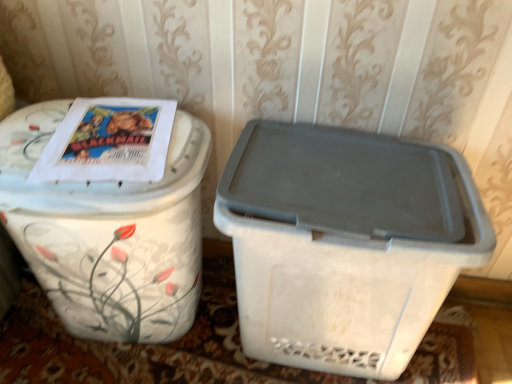
Find the location of a particular element. The width and height of the screenshot is (512, 384). white glossy trash can at upper left, arranged as the 1th waste container when viewed from the left is located at coordinates (109, 233).

Describe the element at coordinates (109, 233) in the screenshot. I see `white glossy trash can at upper left, arranged as the 1th waste container when viewed from the left` at that location.

Identify the location of white plastic container at right, the second waste container from the left. (345, 243).

What do you see at coordinates (345, 243) in the screenshot?
I see `white plastic container at right, the second waste container from the left` at bounding box center [345, 243].

The height and width of the screenshot is (384, 512). I want to click on white glossy trash can at upper left, acting as the 2th waste container starting from the right, so click(x=109, y=233).

Between white plastic container at right, the second waste container from the left, and white glossy trash can at upper left, arranged as the 1th waste container when viewed from the left, which one appears on the left side from the viewer's perspective?

From the viewer's perspective, white glossy trash can at upper left, arranged as the 1th waste container when viewed from the left, appears more on the left side.

Based on the photo, considering the positions of objects white plastic container at right, which ranks as the first waste container in right-to-left order, and white glossy trash can at upper left, acting as the 2th waste container starting from the right, in the image provided, who is in front, white plastic container at right, which ranks as the first waste container in right-to-left order, or white glossy trash can at upper left, acting as the 2th waste container starting from the right,?

white glossy trash can at upper left, acting as the 2th waste container starting from the right, is more forward.

Is point (393, 278) closer or farther from the camera than point (26, 252)?

Clearly, point (393, 278) is closer to the camera than point (26, 252).

From the image's perspective, which one is positioned higher, white plastic container at right, which ranks as the first waste container in right-to-left order, or white glossy trash can at upper left, acting as the 2th waste container starting from the right?

white glossy trash can at upper left, acting as the 2th waste container starting from the right.

From a real-world perspective, is white plastic container at right, the second waste container from the left, physically above white glossy trash can at upper left, arranged as the 1th waste container when viewed from the left?

No.

Looking at their sizes, would you say white plastic container at right, which ranks as the first waste container in right-to-left order, is wider or thinner than white glossy trash can at upper left, acting as the 2th waste container starting from the right?

In the image, white plastic container at right, which ranks as the first waste container in right-to-left order, appears to be more narrow than white glossy trash can at upper left, acting as the 2th waste container starting from the right.

Does white plastic container at right, which ranks as the first waste container in right-to-left order, have a greater height compared to white glossy trash can at upper left, arranged as the 1th waste container when viewed from the left?

In fact, white plastic container at right, which ranks as the first waste container in right-to-left order, may be shorter than white glossy trash can at upper left, arranged as the 1th waste container when viewed from the left.

Does white plastic container at right, which ranks as the first waste container in right-to-left order, have a larger size compared to white glossy trash can at upper left, arranged as the 1th waste container when viewed from the left?

Incorrect, white plastic container at right, which ranks as the first waste container in right-to-left order, is not larger than white glossy trash can at upper left, arranged as the 1th waste container when viewed from the left.

Is white plastic container at right, which ranks as the first waste container in right-to-left order, inside the boundaries of white glossy trash can at upper left, acting as the 2th waste container starting from the right, or outside?

white plastic container at right, which ranks as the first waste container in right-to-left order, lies outside white glossy trash can at upper left, acting as the 2th waste container starting from the right.

Is white plastic container at right, the second waste container from the left, beside white glossy trash can at upper left, arranged as the 1th waste container when viewed from the left?

white plastic container at right, the second waste container from the left, and white glossy trash can at upper left, arranged as the 1th waste container when viewed from the left, are clearly separated.

Is white plastic container at right, which ranks as the first waste container in right-to-left order, oriented towards white glossy trash can at upper left, arranged as the 1th waste container when viewed from the left?

No, white plastic container at right, which ranks as the first waste container in right-to-left order, is not aimed at white glossy trash can at upper left, arranged as the 1th waste container when viewed from the left.

How much distance is there between white plastic container at right, the second waste container from the left, and white glossy trash can at upper left, arranged as the 1th waste container when viewed from the left?

A distance of 27.40 centimeters exists between white plastic container at right, the second waste container from the left, and white glossy trash can at upper left, arranged as the 1th waste container when viewed from the left.

At what (x,y) coordinates should I click in order to perform the action: click on waste container lying in front of the white plastic container at right, the second waste container from the left. Please return your answer as a coordinate pair (x, y). The image size is (512, 384). Looking at the image, I should click on (109, 233).

Is white glossy trash can at upper left, arranged as the 1th waste container when viewed from the left, at the right side of white plastic container at right, the second waste container from the left?

No.

Is white glossy trash can at upper left, acting as the 2th waste container starting from the right, in front of white plastic container at right, the second waste container from the left?

Yes, it is.

In the scene shown: Which is less distant, [181,215] or [362,269]?

Clearly, point [181,215] is more distant from the camera than point [362,269].

From the image's perspective, is white glossy trash can at upper left, acting as the 2th waste container starting from the right, located above white plastic container at right, which ranks as the first waste container in right-to-left order?

Indeed, from the image's perspective, white glossy trash can at upper left, acting as the 2th waste container starting from the right, is shown above white plastic container at right, which ranks as the first waste container in right-to-left order.

From a real-world perspective, which object rests below the other?

From a 3D spatial view, white plastic container at right, the second waste container from the left, is below.

Does white glossy trash can at upper left, arranged as the 1th waste container when viewed from the left, have a lesser width compared to white plastic container at right, which ranks as the first waste container in right-to-left order?

In fact, white glossy trash can at upper left, arranged as the 1th waste container when viewed from the left, might be wider than white plastic container at right, which ranks as the first waste container in right-to-left order.

Between white glossy trash can at upper left, acting as the 2th waste container starting from the right, and white plastic container at right, which ranks as the first waste container in right-to-left order, which one has less height?

white plastic container at right, which ranks as the first waste container in right-to-left order, is shorter.

Is white glossy trash can at upper left, arranged as the 1th waste container when viewed from the left, bigger than white plastic container at right, the second waste container from the left?

Yes.

Is white plastic container at right, the second waste container from the left, a part of white glossy trash can at upper left, acting as the 2th waste container starting from the right?

No, white plastic container at right, the second waste container from the left, is located outside of white glossy trash can at upper left, acting as the 2th waste container starting from the right.

Would you consider white glossy trash can at upper left, acting as the 2th waste container starting from the right, to be distant from white plastic container at right, the second waste container from the left?

No, white glossy trash can at upper left, acting as the 2th waste container starting from the right, is not far from white plastic container at right, the second waste container from the left.

Does white glossy trash can at upper left, arranged as the 1th waste container when viewed from the left, turn towards white plastic container at right, the second waste container from the left?

No.

Can you tell me how much white glossy trash can at upper left, arranged as the 1th waste container when viewed from the left, and white plastic container at right, which ranks as the first waste container in right-to-left order, differ in facing direction?

They differ by 1.12 degrees in their facing directions.

You are a GUI agent. You are given a task and a screenshot of the screen. Output one action in this format:
    pyautogui.click(x=<x>, y=<y>)
    Task: Click on the waste container below the white glossy trash can at upper left, arranged as the 1th waste container when viewed from the left (from a real-world perspective)
    Image resolution: width=512 pixels, height=384 pixels.
    Given the screenshot: What is the action you would take?
    pyautogui.click(x=345, y=243)

Where is `waste container located above the white plastic container at right, which ranks as the first waste container in right-to-left order (from a real-world perspective)`? The image size is (512, 384). waste container located above the white plastic container at right, which ranks as the first waste container in right-to-left order (from a real-world perspective) is located at coordinates (109, 233).

Where is `waste container behind the white glossy trash can at upper left, acting as the 2th waste container starting from the right`? This screenshot has width=512, height=384. waste container behind the white glossy trash can at upper left, acting as the 2th waste container starting from the right is located at coordinates [345, 243].